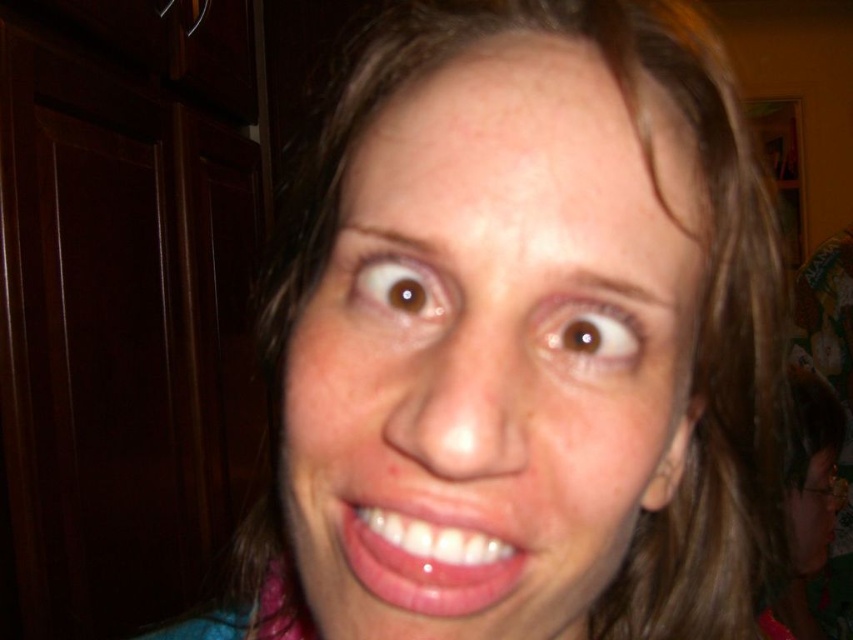
Looking at this image, who is taller, natural skin tone at center or glossy pink lips at center?

With more height is natural skin tone at center.

Does natural skin tone at center have a smaller size compared to glossy pink lips at center?

No.

Between point (527, 77) and point (418, 538), which one is positioned in front?

Positioned in front is point (418, 538).

The width and height of the screenshot is (853, 640). Identify the location of natural skin tone at center. (492, 348).